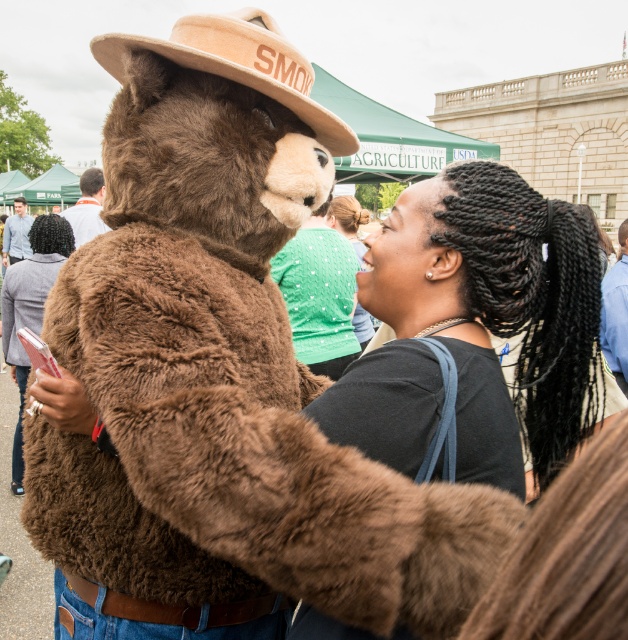
Question: Does black matte hair at upper right have a lesser width compared to beige felt hat at upper center?

Choices:
 (A) no
 (B) yes

Answer: (A)

Question: Considering the relative positions of black matte hair at upper right and beige felt hat at upper center in the image provided, where is black matte hair at upper right located with respect to beige felt hat at upper center?

Choices:
 (A) above
 (B) below

Answer: (B)

Question: Where is black matte hair at upper right located in relation to beige felt hat at upper center in the image?

Choices:
 (A) above
 (B) below

Answer: (B)

Question: Which object appears closest to the camera in this image?

Choices:
 (A) black matte hair at upper right
 (B) beige felt hat at upper center

Answer: (A)

Question: Which object is farther from the camera taking this photo?

Choices:
 (A) black matte hair at upper right
 (B) beige felt hat at upper center

Answer: (B)